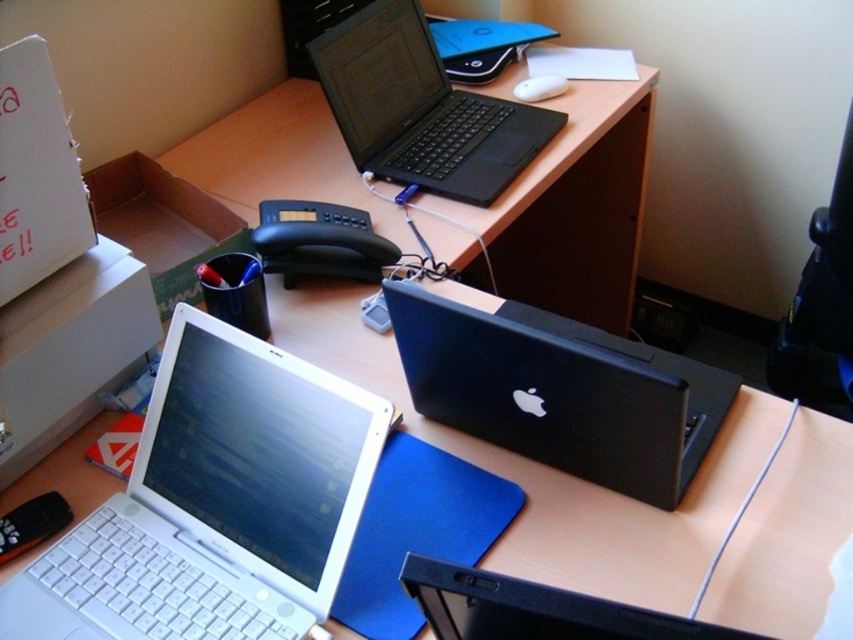
You are organizing the desk and need to place a new item between the black matte laptop at center and the white cardboard box at upper left. Which object should you place the item closer to if you want it to be closer to the taller object?

The white cardboard box at upper left is taller than the black matte laptop at center. Therefore, placing the item closer to the white cardboard box at upper left will ensure it is near the taller object.

From the picture: You are organizing your desk and need to place a new item between the white laptop in the foreground and the black matte laptop at lower center. Based on their positions, where should you place the new item?

The new item should be placed between the white laptop in the foreground and the black matte laptop at lower center. Since the black matte laptop at lower center is located at point (x=534, y=609), you can position the new item along the line connecting their positions to ensure it is centered between them.

You are a delivery person who just arrived at the office. You need to place a package on the desk between the cardboard box at left and the camera. The package is 2 feet wide. Is there enough space between them to place the package?

The distance between the cardboard box at left and the camera is 3.61 feet. Since the package is 2 feet wide, there is enough space to place it between them.